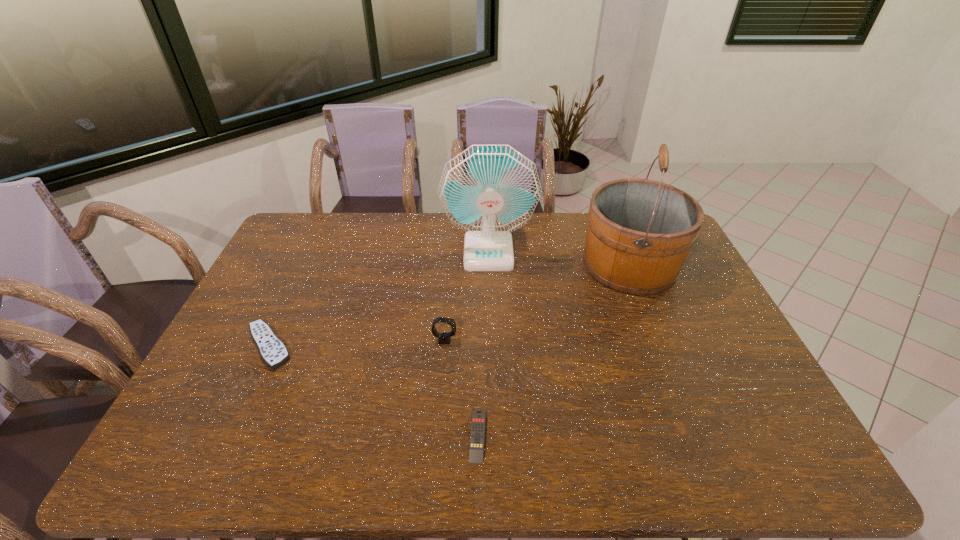
Locate an element on the screen. This screenshot has width=960, height=540. fan is located at coordinates (489, 191).

Identify the location of bucket. The height and width of the screenshot is (540, 960). (640, 231).

The height and width of the screenshot is (540, 960). I want to click on the third tallest object, so pos(444,338).

You are a GUI agent. You are given a task and a screenshot of the screen. Output one action in this format:
    pyautogui.click(x=<x>, y=<y>)
    Task: Click on the left remote control
    Image resolution: width=960 pixels, height=540 pixels.
    Given the screenshot: What is the action you would take?
    pyautogui.click(x=273, y=351)

The height and width of the screenshot is (540, 960). Find the location of `the leftmost object`. the leftmost object is located at coordinates (273, 351).

Find the location of a particular element. This screenshot has width=960, height=540. the right remote control is located at coordinates (476, 450).

You are a GUI agent. You are given a task and a screenshot of the screen. Output one action in this format:
    pyautogui.click(x=<x>, y=<y>)
    Task: Click on the nearest object
    
    Given the screenshot: What is the action you would take?
    pyautogui.click(x=476, y=450)

Locate an element on the screen. This screenshot has width=960, height=540. free space located 0.230m in front of the fan to face the airflow is located at coordinates (491, 322).

Find the location of a particular element. vacant point located on the front of the bucket is located at coordinates click(672, 369).

Where is `free spot located 0.320m on the face of the watch`? Image resolution: width=960 pixels, height=540 pixels. free spot located 0.320m on the face of the watch is located at coordinates (569, 340).